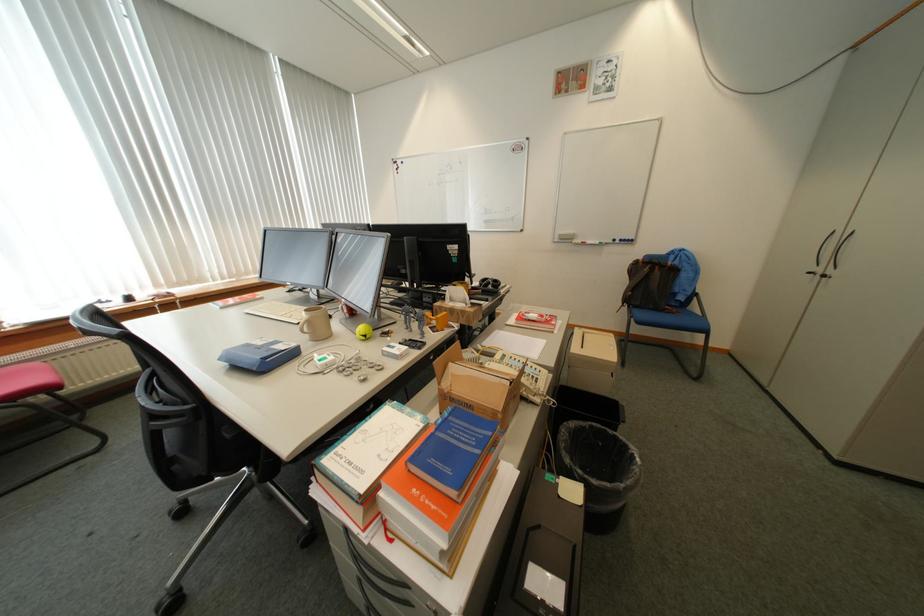
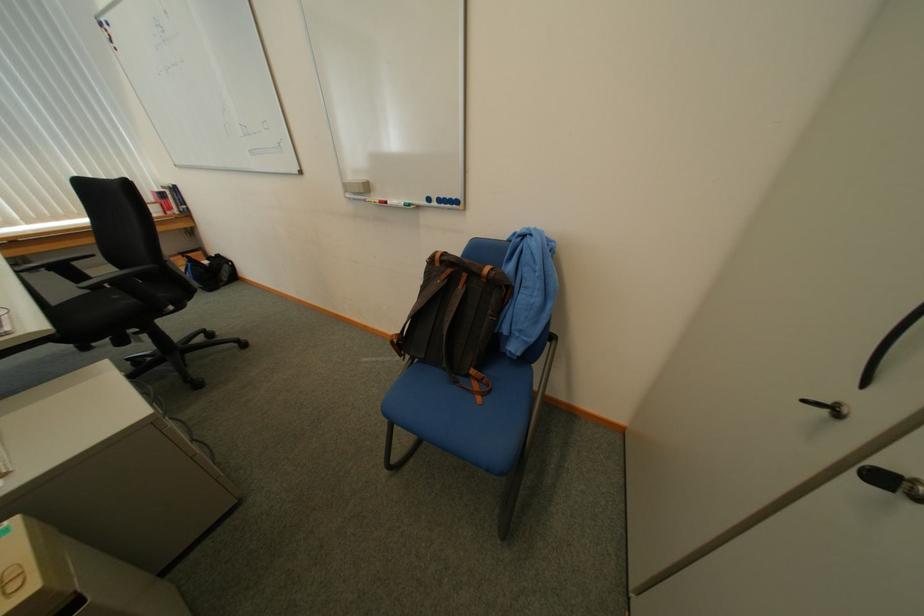
In the second image, find the point that corresponds to (x=666, y=273) in the first image.

(469, 290)